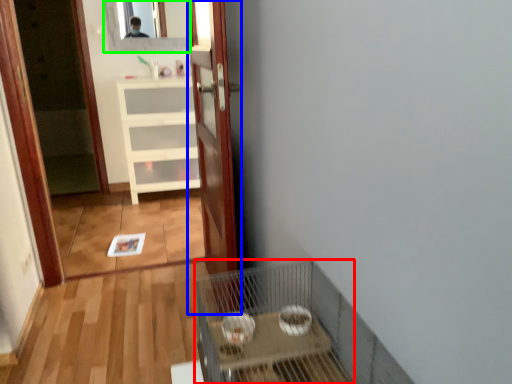
Question: Which is farther away from cage (highlighted by a red box)? door (highlighted by a blue box) or mirror (highlighted by a green box)?

Choices:
 (A) door
 (B) mirror

Answer: (B)